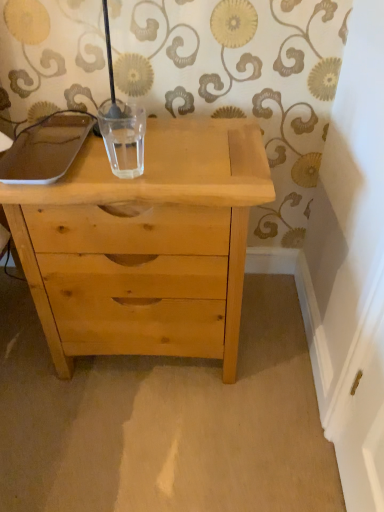
Question: Considering the relative sizes of transparent glass at center and natural wood chest of drawers at center in the image provided, is transparent glass at center thinner than natural wood chest of drawers at center?

Choices:
 (A) no
 (B) yes

Answer: (B)

Question: Could natural wood chest of drawers at center be considered to be inside transparent glass at center?

Choices:
 (A) yes
 (B) no

Answer: (B)

Question: From the image's perspective, does transparent glass at center appear lower than natural wood chest of drawers at center?

Choices:
 (A) yes
 (B) no

Answer: (B)

Question: Considering the relative sizes of transparent glass at center and natural wood chest of drawers at center in the image provided, is transparent glass at center bigger than natural wood chest of drawers at center?

Choices:
 (A) yes
 (B) no

Answer: (B)

Question: Can you confirm if transparent glass at center is positioned to the left of natural wood chest of drawers at center?

Choices:
 (A) yes
 (B) no

Answer: (A)

Question: Is transparent glass at center located outside natural wood chest of drawers at center?

Choices:
 (A) yes
 (B) no

Answer: (A)

Question: From the image's perspective, would you say natural wood chest of drawers at center is shown under transparent glass at center?

Choices:
 (A) yes
 (B) no

Answer: (A)

Question: From a real-world perspective, is natural wood chest of drawers at center positioned under transparent glass at center based on gravity?

Choices:
 (A) no
 (B) yes

Answer: (B)

Question: Does natural wood chest of drawers at center lie in front of transparent glass at center?

Choices:
 (A) yes
 (B) no

Answer: (A)

Question: Is natural wood chest of drawers at center facing away from transparent glass at center?

Choices:
 (A) yes
 (B) no

Answer: (B)

Question: Does natural wood chest of drawers at center have a greater width compared to transparent glass at center?

Choices:
 (A) no
 (B) yes

Answer: (B)

Question: Considering the relative sizes of natural wood chest of drawers at center and transparent glass at center in the image provided, is natural wood chest of drawers at center bigger than transparent glass at center?

Choices:
 (A) yes
 (B) no

Answer: (A)

Question: From a real-world perspective, is natural wood chest of drawers at center positioned above or below transparent glass at center?

Choices:
 (A) below
 (B) above

Answer: (A)